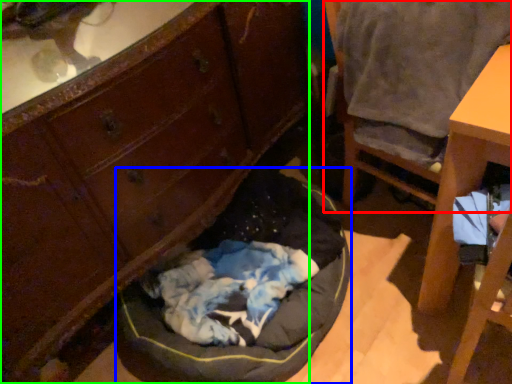
Question: Estimate the real-world distances between objects in this image. Which object is farther from chair (highlighted by a red box), dog bed (highlighted by a blue box) or cabinetry (highlighted by a green box)?

Choices:
 (A) dog bed
 (B) cabinetry

Answer: (A)